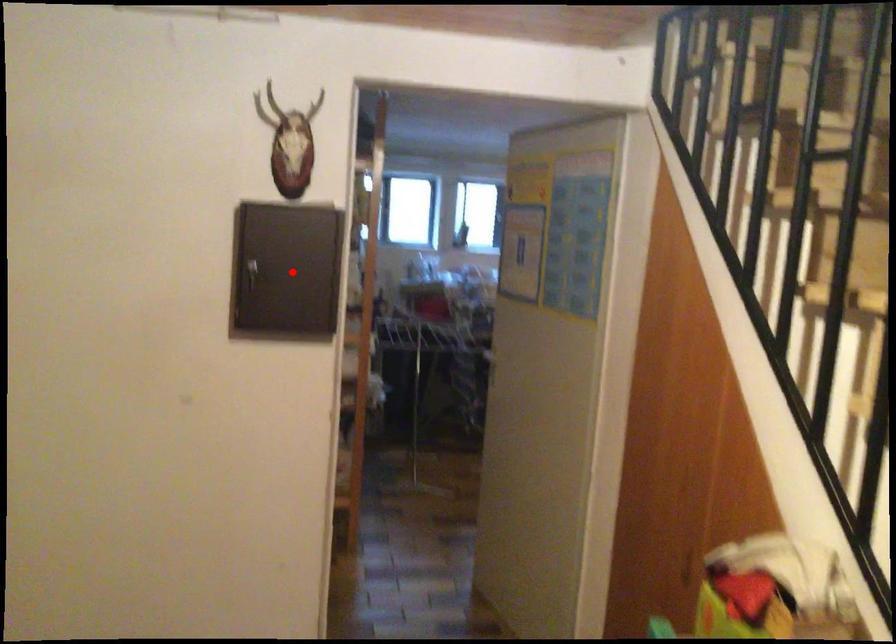
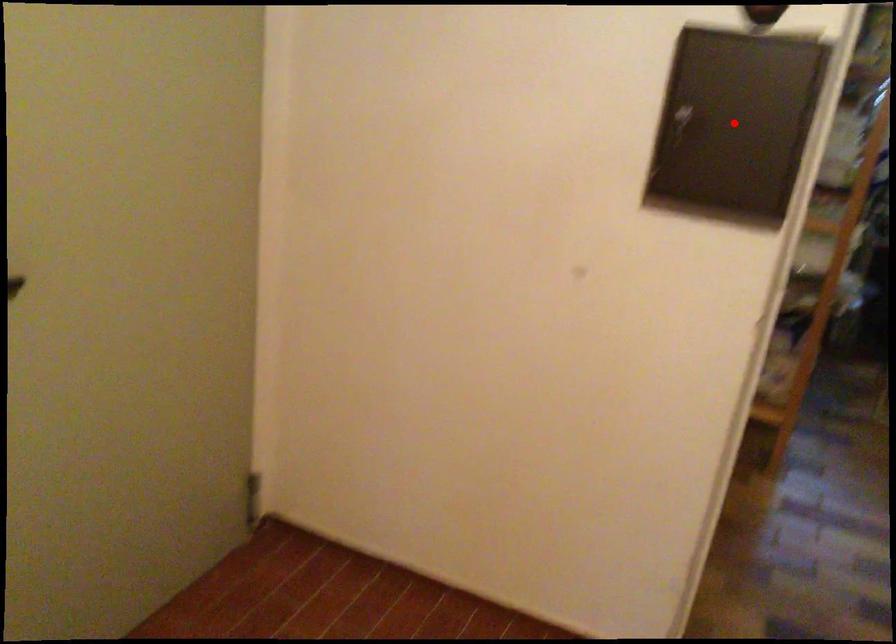
I am providing you with two images of the same scene from different viewpoints. A red point is marked on the first image and another point is marked on the second image. Is the marked point in image1 the same physical position as the marked point in image2?

Yes